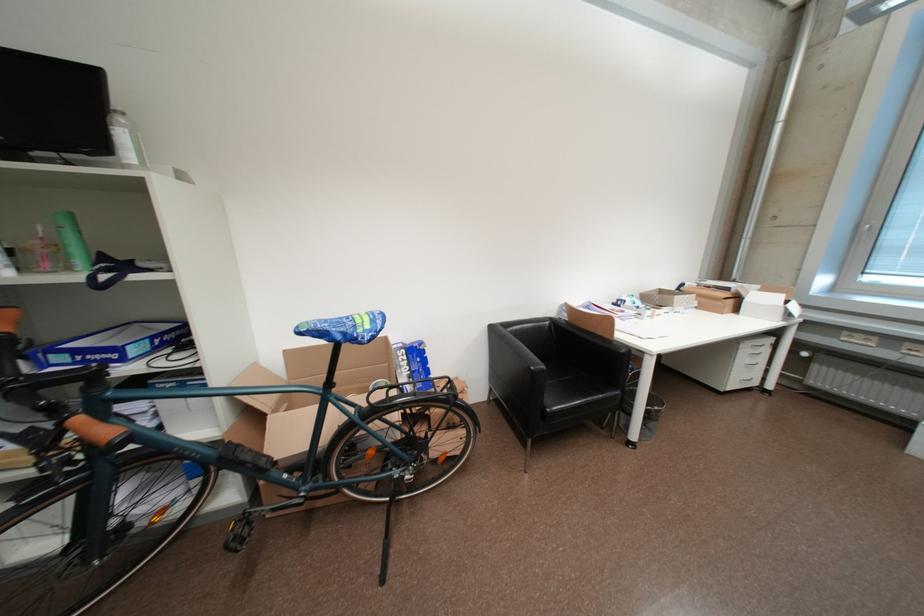
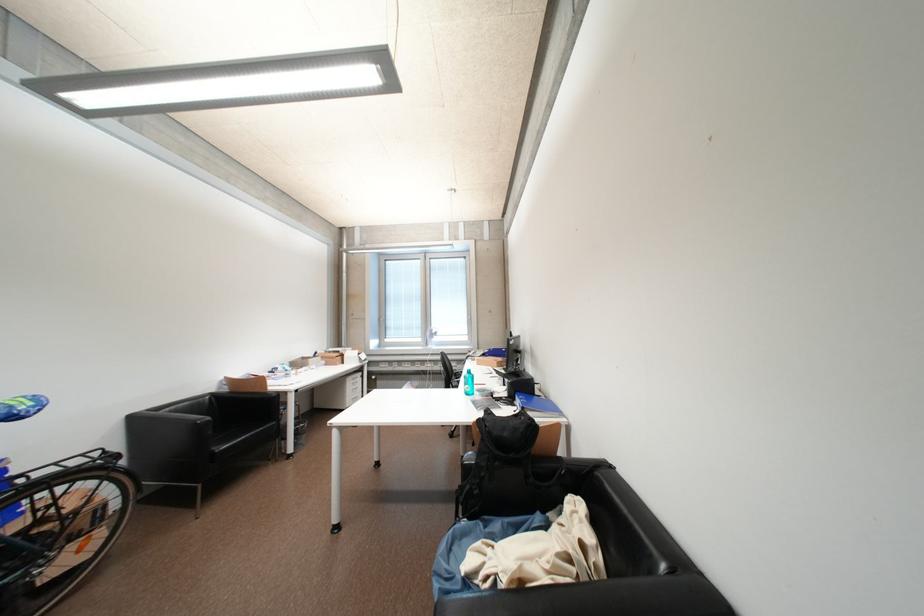
The point at (x=573, y=318) is marked in the first image. Where is the corresponding point in the second image?

(234, 391)